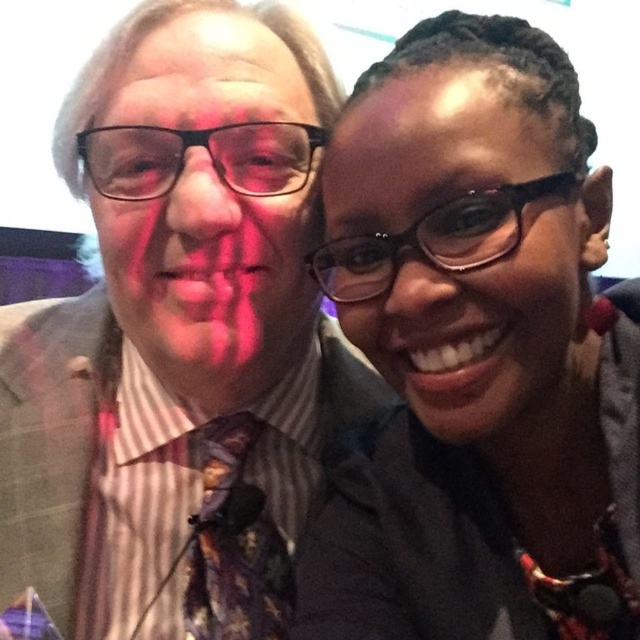
Between striped fabric shirt at center and matte black glasses at upper right, which one appears on the left side from the viewer's perspective?

From the viewer's perspective, striped fabric shirt at center appears more on the left side.

Who is more distant from viewer, [124,234] or [556,348]?

The point [124,234] is behind.

What do you see at coordinates (179, 337) in the screenshot? I see `striped fabric shirt at center` at bounding box center [179, 337].

Identify the location of striped fabric shirt at center. This screenshot has width=640, height=640. [x=179, y=337].

Does matte black glasses at upper right appear under floral silk tie at center?

No, matte black glasses at upper right is not below floral silk tie at center.

Is matte black glasses at upper right smaller than floral silk tie at center?

Actually, matte black glasses at upper right might be larger than floral silk tie at center.

Is point (442, 113) positioned behind point (195, 592)?

That is False.

Identify the location of matte black glasses at upper right. (477, 353).

Can you confirm if striped fabric shirt at center is wider than floral silk tie at center?

Correct, the width of striped fabric shirt at center exceeds that of floral silk tie at center.

Which is below, striped fabric shirt at center or floral silk tie at center?

floral silk tie at center is below.

Which is in front, point (307, 445) or point (198, 532)?

Point (198, 532) is in front.

Where is `striped fabric shirt at center`? This screenshot has width=640, height=640. striped fabric shirt at center is located at coordinates (179, 337).